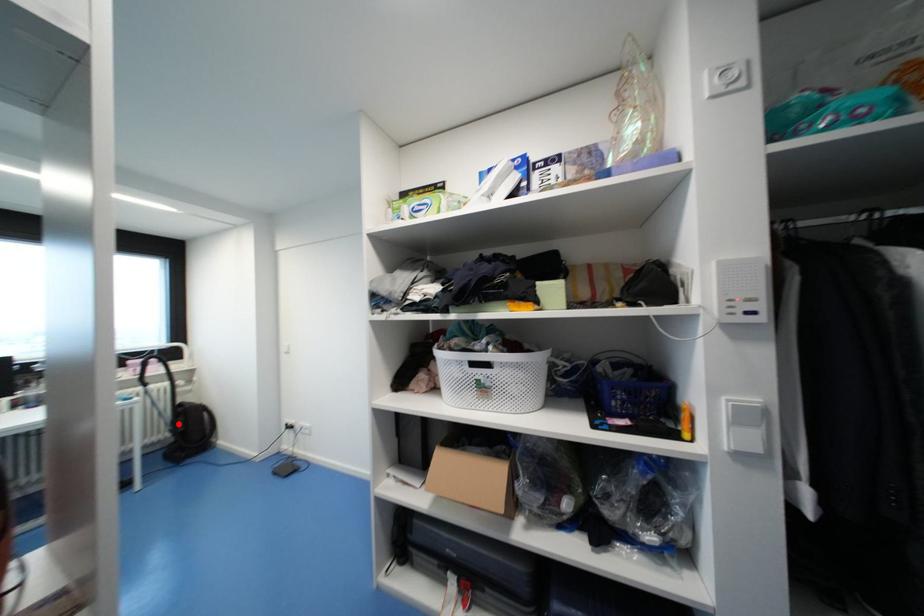
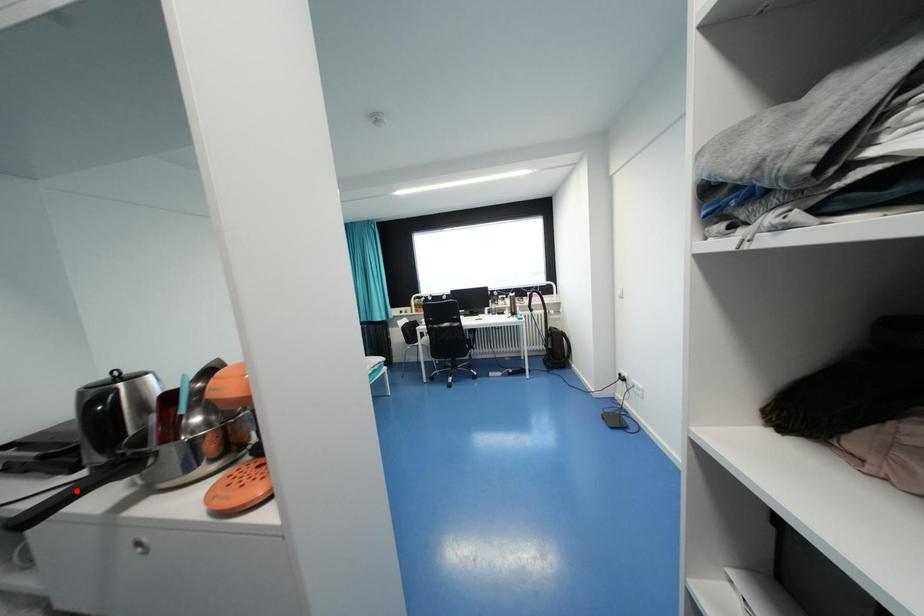
I am providing you with two images of the same scene from different viewpoints. A red point is marked on the first image and another point is marked on the second image. Are the points marked in image1 and image2 representing the same 3D position?

No